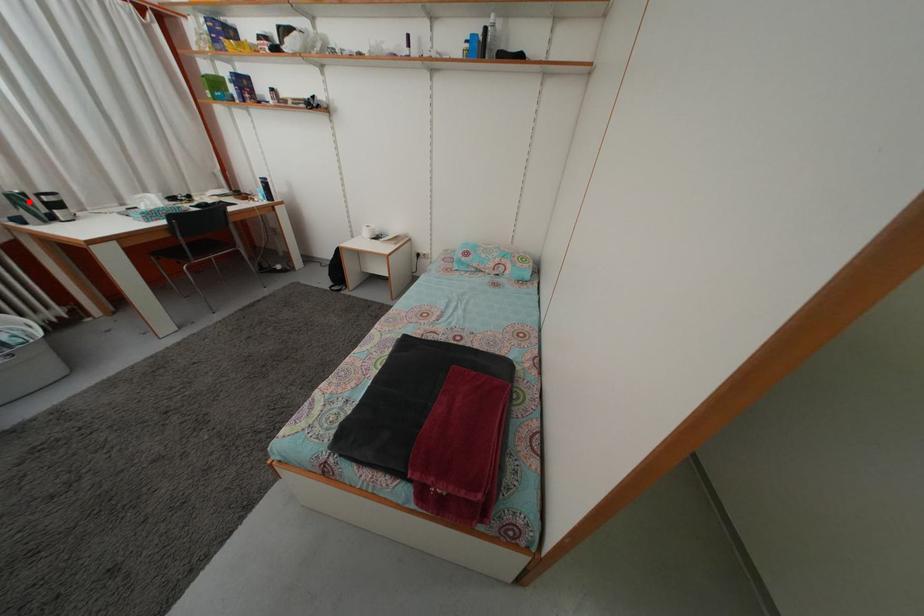
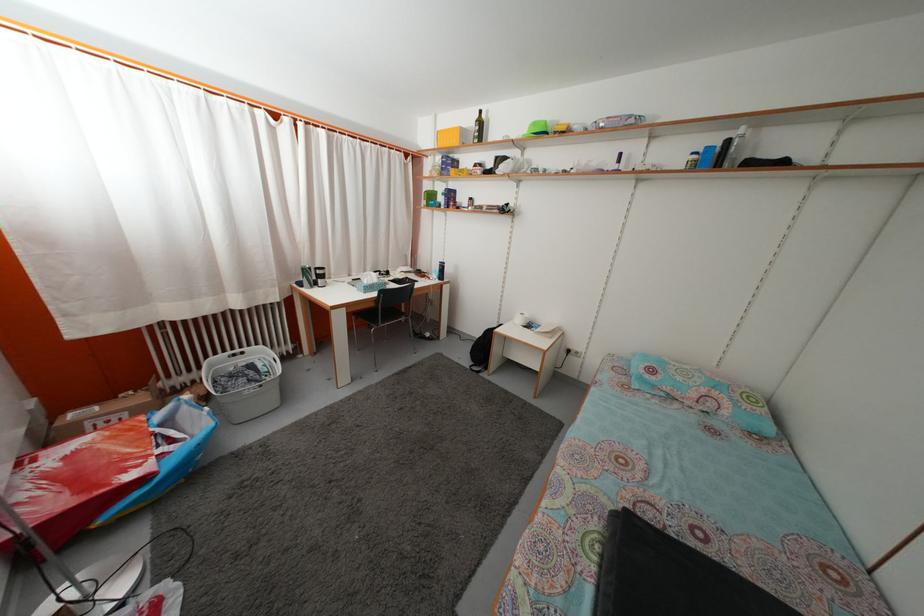
Question: I am providing you with two images of the same scene from different viewpoints. A red point is shown in image1. For the corresponding object point in image2, is it positioned nearer or farther from the camera?

Choices:
 (A) Nearer
 (B) Farther

Answer: (A)